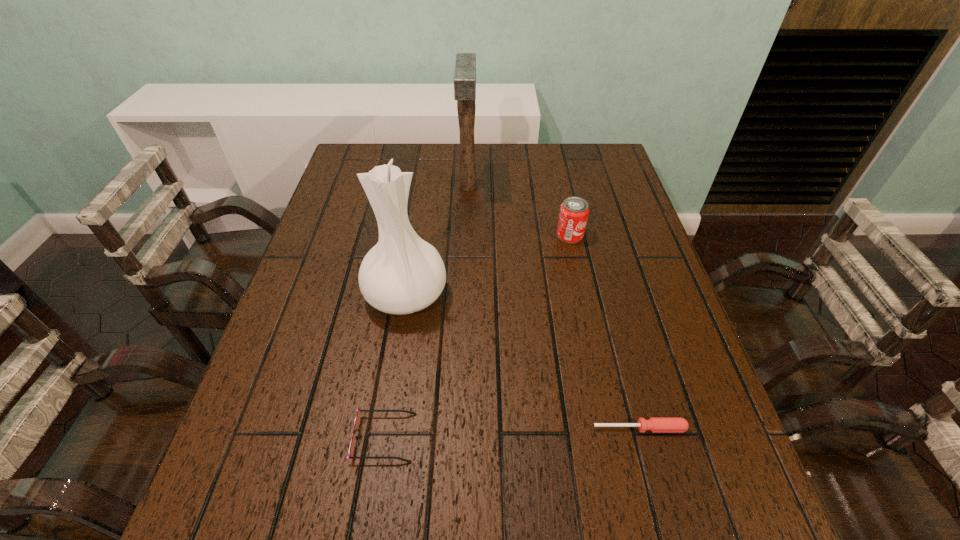
Where is `blank space located 0.200m on the bridge of the fourth tallest object`? The width and height of the screenshot is (960, 540). blank space located 0.200m on the bridge of the fourth tallest object is located at coordinates (521, 437).

Where is `free space located 0.340m on the back of the shortest object`? free space located 0.340m on the back of the shortest object is located at coordinates (604, 291).

This screenshot has width=960, height=540. Identify the location of object that is at the far edge. (465, 66).

Where is `object located in the right edge section of the desktop`? This screenshot has width=960, height=540. object located in the right edge section of the desktop is located at coordinates (655, 424).

Find the location of a particular element. The image size is (960, 540). free location at the far edge is located at coordinates [x=550, y=156].

Identify the location of vacant space at the near edge of the desktop. This screenshot has width=960, height=540. (658, 534).

Image resolution: width=960 pixels, height=540 pixels. In the image, there is a desktop. What are the coordinates of `free space at the left edge` in the screenshot? It's located at (324, 362).

Find the location of `vacant space at the right edge of the desktop`. vacant space at the right edge of the desktop is located at coordinates (665, 333).

Image resolution: width=960 pixels, height=540 pixels. Find the location of `free space at the far left corner of the desktop`. free space at the far left corner of the desktop is located at coordinates tap(356, 164).

The height and width of the screenshot is (540, 960). I want to click on free space at the far right corner, so 607,154.